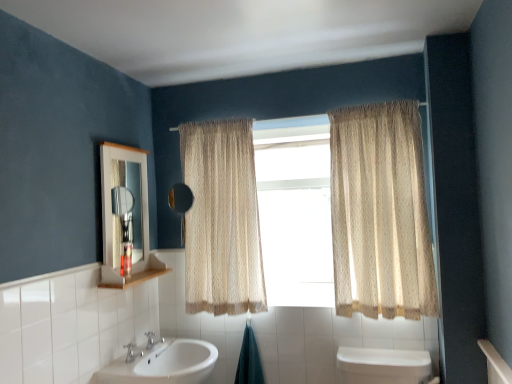
Question: Is white glossy sink at lower center smaller than black matte mirror at center?

Choices:
 (A) yes
 (B) no

Answer: (B)

Question: Would you consider white glossy sink at lower center to be distant from black matte mirror at center?

Choices:
 (A) no
 (B) yes

Answer: (A)

Question: Is white glossy sink at lower center further to the viewer compared to black matte mirror at center?

Choices:
 (A) yes
 (B) no

Answer: (B)

Question: Is white glossy sink at lower center to the right of black matte mirror at center from the viewer's perspective?

Choices:
 (A) no
 (B) yes

Answer: (A)

Question: From the image's perspective, is white glossy sink at lower center located beneath black matte mirror at center?

Choices:
 (A) no
 (B) yes

Answer: (B)

Question: Looking at the image, does beige sheer curtain at center, the 2th curtain from the right, seem bigger or smaller compared to translucent fabric curtain at center?

Choices:
 (A) small
 (B) big

Answer: (B)

Question: From a real-world perspective, is beige sheer curtain at center, the 2th curtain from the right, physically located above or below translucent fabric curtain at center?

Choices:
 (A) above
 (B) below

Answer: (A)

Question: Is beige sheer curtain at center, the 2th curtain from the right, in front of or behind translucent fabric curtain at center in the image?

Choices:
 (A) behind
 (B) front

Answer: (B)

Question: From their relative heights in the image, would you say beige sheer curtain at center, the 2th curtain from the right, is taller or shorter than translucent fabric curtain at center?

Choices:
 (A) short
 (B) tall

Answer: (B)

Question: From the image's perspective, is white glossy sink at lower center above or below white wood medicine cabinet at upper left?

Choices:
 (A) above
 (B) below

Answer: (B)

Question: Looking at the image, does white glossy sink at lower center seem bigger or smaller compared to white wood medicine cabinet at upper left?

Choices:
 (A) big
 (B) small

Answer: (A)

Question: Is white glossy sink at lower center inside the boundaries of white wood medicine cabinet at upper left, or outside?

Choices:
 (A) inside
 (B) outside

Answer: (B)

Question: Considering the positions of point (x=192, y=365) and point (x=142, y=226), is point (x=192, y=365) closer or farther from the camera than point (x=142, y=226)?

Choices:
 (A) closer
 (B) farther

Answer: (A)

Question: Do you think white wood medicine cabinet at upper left is within beige textured curtain at right, acting as the first curtain starting from the right, or outside of it?

Choices:
 (A) inside
 (B) outside

Answer: (B)

Question: From the image's perspective, is white wood medicine cabinet at upper left above or below beige textured curtain at right, placed as the 2th curtain when sorted from left to right?

Choices:
 (A) above
 (B) below

Answer: (B)